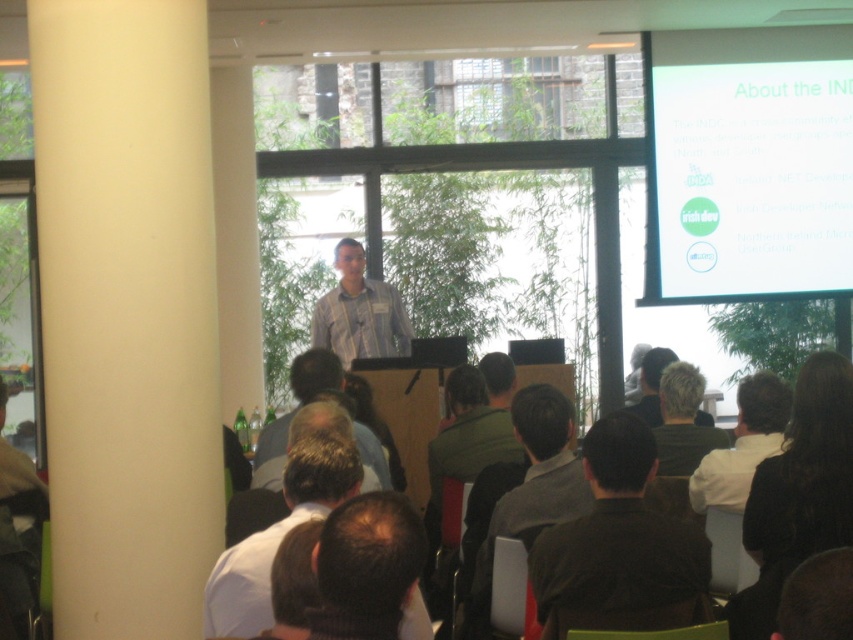
Can you confirm if white matte projection screen at upper right is positioned above dark brown leather jacket at center?

Yes.

Is white matte projection screen at upper right positioned in front of dark brown leather jacket at center?

No, it is not.

Is point (651, 42) farther from camera compared to point (596, 602)?

Yes.

Where is `white matte projection screen at upper right`? white matte projection screen at upper right is located at coordinates (747, 164).

Which is behind, point (546, 464) or point (225, 548)?

Point (546, 464)

The image size is (853, 640). I want to click on dark gray fabric shirt at center, so click(529, 492).

At what (x,y) coordinates should I click in order to perform the action: click on dark gray fabric shirt at center. Please return your answer as a coordinate pair (x, y). The height and width of the screenshot is (640, 853). Looking at the image, I should click on (529, 492).

Measure the distance between white matte projection screen at upper right and camera.

A distance of 19.13 feet exists between white matte projection screen at upper right and camera.

How far apart are white matte projection screen at upper right and dark brown hair at center?

white matte projection screen at upper right and dark brown hair at center are 9.39 feet apart from each other.

Which is behind, point (807, 208) or point (279, 426)?

The point (807, 208) is behind.

Find the location of a particular element. This screenshot has height=640, width=853. white matte projection screen at upper right is located at coordinates (747, 164).